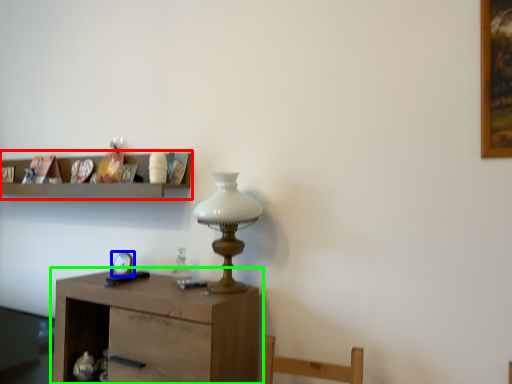
Question: Based on their relative distances, which object is nearer to shelf (highlighted by a red box)? Choose from clock (highlighted by a blue box) and table (highlighted by a green box).

Choices:
 (A) clock
 (B) table

Answer: (A)